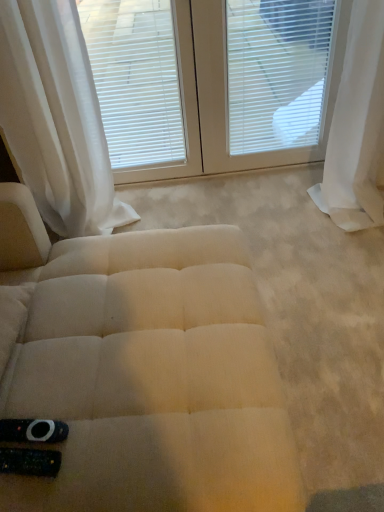
Question: From a real-world perspective, is white sheer curtain at right, the first curtain viewed from the right, physically below white sheer curtain at upper left, positioned as the second curtain in right-to-left order?

Choices:
 (A) no
 (B) yes

Answer: (B)

Question: From the image's perspective, would you say white sheer curtain at right, the second curtain positioned from the left, is shown under white sheer curtain at upper left, placed as the 1th curtain when sorted from left to right?

Choices:
 (A) yes
 (B) no

Answer: (B)

Question: Can you confirm if white sheer curtain at right, the second curtain positioned from the left, is positioned to the right of white sheer curtain at upper left, placed as the 1th curtain when sorted from left to right?

Choices:
 (A) yes
 (B) no

Answer: (A)

Question: Is white sheer curtain at right, the first curtain viewed from the right, wider than white sheer curtain at upper left, placed as the 1th curtain when sorted from left to right?

Choices:
 (A) no
 (B) yes

Answer: (B)

Question: Is the position of white sheer curtain at right, the first curtain viewed from the right, less distant than that of white sheer curtain at upper left, positioned as the second curtain in right-to-left order?

Choices:
 (A) yes
 (B) no

Answer: (B)

Question: Is white sheer curtain at right, the second curtain positioned from the left, smaller than white sheer curtain at upper left, placed as the 1th curtain when sorted from left to right?

Choices:
 (A) yes
 (B) no

Answer: (A)

Question: Can we say white sheer curtain at upper left, placed as the 1th curtain when sorted from left to right, lies outside white matte window blind at upper center?

Choices:
 (A) no
 (B) yes

Answer: (B)

Question: Considering the relative sizes of white sheer curtain at upper left, placed as the 1th curtain when sorted from left to right, and white matte window blind at upper center in the image provided, is white sheer curtain at upper left, placed as the 1th curtain when sorted from left to right, bigger than white matte window blind at upper center?

Choices:
 (A) no
 (B) yes

Answer: (B)

Question: Is the depth of white sheer curtain at upper left, positioned as the second curtain in right-to-left order, greater than that of white matte window blind at upper center?

Choices:
 (A) no
 (B) yes

Answer: (A)

Question: Does white sheer curtain at upper left, positioned as the second curtain in right-to-left order, have a lesser width compared to white matte window blind at upper center?

Choices:
 (A) no
 (B) yes

Answer: (A)

Question: Does white sheer curtain at upper left, placed as the 1th curtain when sorted from left to right, turn towards white matte window blind at upper center?

Choices:
 (A) no
 (B) yes

Answer: (A)

Question: Is white sheer curtain at upper left, positioned as the second curtain in right-to-left order, beside white matte window blind at upper center?

Choices:
 (A) no
 (B) yes

Answer: (A)

Question: Is white sheer curtain at upper left, placed as the 1th curtain when sorted from left to right, bigger than white sheer curtain at right, the second curtain positioned from the left?

Choices:
 (A) yes
 (B) no

Answer: (A)